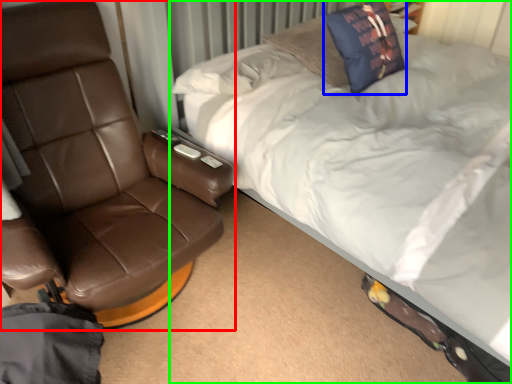
Question: Based on their relative distances, which object is farther from chair (highlighted by a red box)? Choose from throw pillow (highlighted by a blue box) and bed (highlighted by a green box).

Choices:
 (A) throw pillow
 (B) bed

Answer: (A)